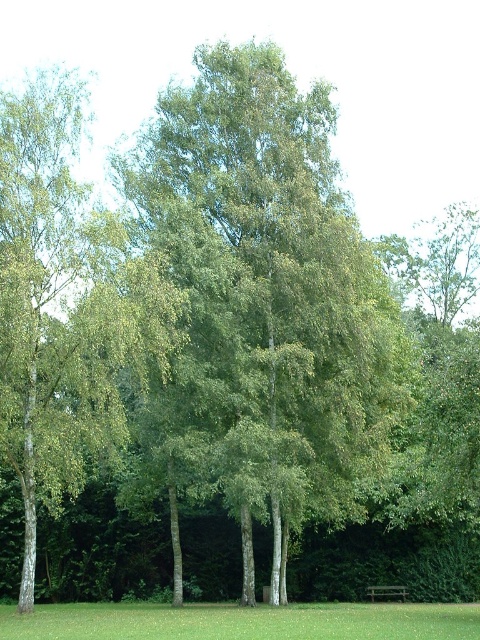
Who is taller, green smooth tree at center or wooden park bench at lower center?

With more height is green smooth tree at center.

Does green smooth tree at center have a greater width compared to wooden park bench at lower center?

Indeed, green smooth tree at center has a greater width compared to wooden park bench at lower center.

Between point (220, 387) and point (406, 589), which one is positioned in front?

Point (220, 387) is more forward.

The width and height of the screenshot is (480, 640). Find the location of `green smooth tree at center`. green smooth tree at center is located at coordinates (267, 296).

Which of these two, green smooth tree at center or green grass at lower center, stands taller?

green smooth tree at center is taller.

Describe the element at coordinates (267, 296) in the screenshot. The image size is (480, 640). I see `green smooth tree at center` at that location.

Between point (192, 115) and point (148, 632), which one is positioned in front?

Positioned in front is point (148, 632).

Find the location of a particular element. green smooth tree at center is located at coordinates (267, 296).

Is green grass at lower center below wooden park bench at lower center?

Actually, green grass at lower center is above wooden park bench at lower center.

The width and height of the screenshot is (480, 640). I want to click on green grass at lower center, so click(x=242, y=621).

At what (x,y) coordinates should I click in order to perform the action: click on green grass at lower center. Please return your answer as a coordinate pair (x, y). Looking at the image, I should click on (242, 621).